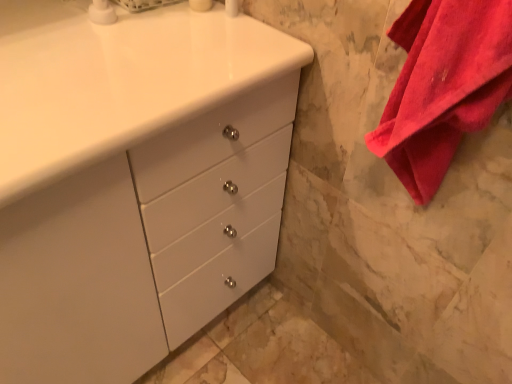
You are a GUI agent. You are given a task and a screenshot of the screen. Output one action in this format:
    pyautogui.click(x=<x>, y=<y>)
    Task: Click on the free space in front of white glossy soap dispenser at upper left
    The image size is (512, 384).
    Given the screenshot: What is the action you would take?
    pyautogui.click(x=88, y=57)